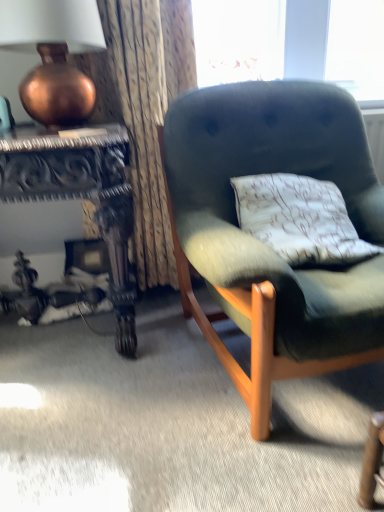
Question: Does textured fabric curtain at upper left have a smaller size compared to velvet green armchair at center?

Choices:
 (A) yes
 (B) no

Answer: (A)

Question: Can you confirm if textured fabric curtain at upper left is positioned to the left of velvet green armchair at center?

Choices:
 (A) yes
 (B) no

Answer: (A)

Question: Does textured fabric curtain at upper left have a greater height compared to velvet green armchair at center?

Choices:
 (A) yes
 (B) no

Answer: (A)

Question: Considering the relative sizes of textured fabric curtain at upper left and velvet green armchair at center in the image provided, is textured fabric curtain at upper left bigger than velvet green armchair at center?

Choices:
 (A) no
 (B) yes

Answer: (A)

Question: Is textured fabric curtain at upper left turned away from velvet green armchair at center?

Choices:
 (A) yes
 (B) no

Answer: (B)

Question: Considering the positions of point (61, 185) and point (193, 81), is point (61, 185) closer or farther from the camera than point (193, 81)?

Choices:
 (A) closer
 (B) farther

Answer: (A)

Question: Considering the positions of carved wood desk at left and textured fabric curtain at upper left in the image, is carved wood desk at left wider or thinner than textured fabric curtain at upper left?

Choices:
 (A) thin
 (B) wide

Answer: (B)

Question: Considering the positions of carved wood desk at left and textured fabric curtain at upper left in the image, is carved wood desk at left taller or shorter than textured fabric curtain at upper left?

Choices:
 (A) tall
 (B) short

Answer: (B)

Question: Is carved wood desk at left to the left or to the right of textured fabric curtain at upper left in the image?

Choices:
 (A) left
 (B) right

Answer: (A)

Question: Considering the positions of copper metallic vase at upper left and textured fabric curtain at upper left in the image, is copper metallic vase at upper left taller or shorter than textured fabric curtain at upper left?

Choices:
 (A) tall
 (B) short

Answer: (B)

Question: Does point (18, 10) appear closer or farther from the camera than point (115, 42)?

Choices:
 (A) closer
 (B) farther

Answer: (A)

Question: In terms of size, does copper metallic vase at upper left appear bigger or smaller than textured fabric curtain at upper left?

Choices:
 (A) small
 (B) big

Answer: (A)

Question: Looking at their shapes, would you say copper metallic vase at upper left is wider or thinner than textured fabric curtain at upper left?

Choices:
 (A) thin
 (B) wide

Answer: (B)

Question: Looking at their shapes, would you say velvet green armchair at center is wider or thinner than textured fabric curtain at upper left?

Choices:
 (A) thin
 (B) wide

Answer: (B)

Question: Considering the relative positions of velvet green armchair at center and textured fabric curtain at upper left in the image provided, is velvet green armchair at center to the left or to the right of textured fabric curtain at upper left?

Choices:
 (A) right
 (B) left

Answer: (A)